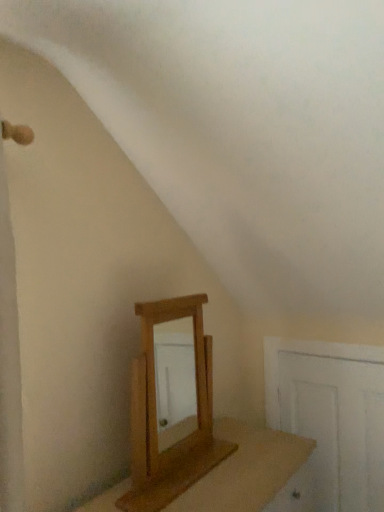
Question: Is there a large distance between wooden table at center and white wooden door at lower right?

Choices:
 (A) yes
 (B) no

Answer: (B)

Question: Considering the relative sizes of wooden table at center and white wooden door at lower right in the image provided, is wooden table at center shorter than white wooden door at lower right?

Choices:
 (A) yes
 (B) no

Answer: (A)

Question: Is the depth of wooden table at center greater than that of white wooden door at lower right?

Choices:
 (A) yes
 (B) no

Answer: (B)

Question: Is wooden table at center in front of white wooden door at lower right?

Choices:
 (A) yes
 (B) no

Answer: (A)

Question: Does wooden table at center have a lesser width compared to white wooden door at lower right?

Choices:
 (A) no
 (B) yes

Answer: (A)

Question: Looking at the image, does white wooden door at lower right seem bigger or smaller compared to wooden table at center?

Choices:
 (A) small
 (B) big

Answer: (A)

Question: Relative to wooden table at center, is white wooden door at lower right in front or behind?

Choices:
 (A) behind
 (B) front

Answer: (A)

Question: In terms of width, does white wooden door at lower right look wider or thinner when compared to wooden table at center?

Choices:
 (A) thin
 (B) wide

Answer: (A)

Question: Based on their positions, is white wooden door at lower right located to the left or right of wooden table at center?

Choices:
 (A) right
 (B) left

Answer: (A)

Question: Looking at the image, does light brown wooden mirror at center seem bigger or smaller compared to wooden table at center?

Choices:
 (A) big
 (B) small

Answer: (B)

Question: Is light brown wooden mirror at center wider or thinner than wooden table at center?

Choices:
 (A) wide
 (B) thin

Answer: (B)

Question: Considering the positions of light brown wooden mirror at center and wooden table at center in the image, is light brown wooden mirror at center taller or shorter than wooden table at center?

Choices:
 (A) tall
 (B) short

Answer: (A)

Question: From the image's perspective, relative to wooden table at center, is light brown wooden mirror at center above or below?

Choices:
 (A) above
 (B) below

Answer: (A)

Question: Based on their positions, is light brown wooden mirror at center located to the left or right of white wooden door at lower right?

Choices:
 (A) left
 (B) right

Answer: (A)

Question: In the image, is light brown wooden mirror at center positioned in front of or behind white wooden door at lower right?

Choices:
 (A) front
 (B) behind

Answer: (A)